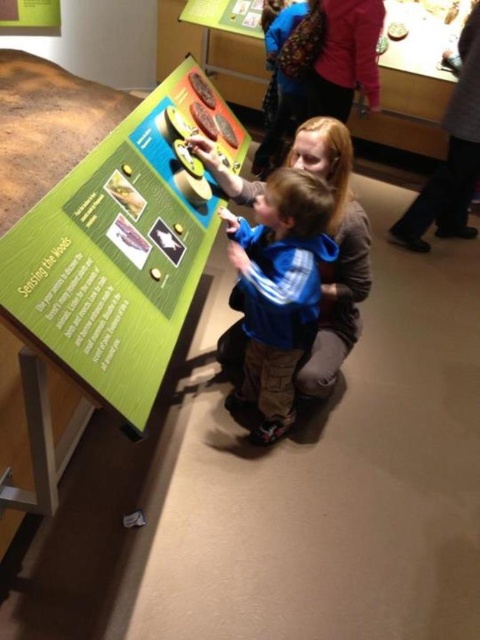
Question: Which object appears farthest from the camera in this image?

Choices:
 (A) green matte board at center
 (B) blue cotton shirt at center

Answer: (B)

Question: Does green matte board at center appear on the right side of blue cotton shirt at center?

Choices:
 (A) no
 (B) yes

Answer: (A)

Question: Does green matte board at center come behind blue cotton shirt at center?

Choices:
 (A) yes
 (B) no

Answer: (B)

Question: Is green matte board at center thinner than blue cotton shirt at center?

Choices:
 (A) no
 (B) yes

Answer: (A)

Question: Which point is farther to the camera?

Choices:
 (A) (159, 163)
 (B) (261, 292)

Answer: (A)